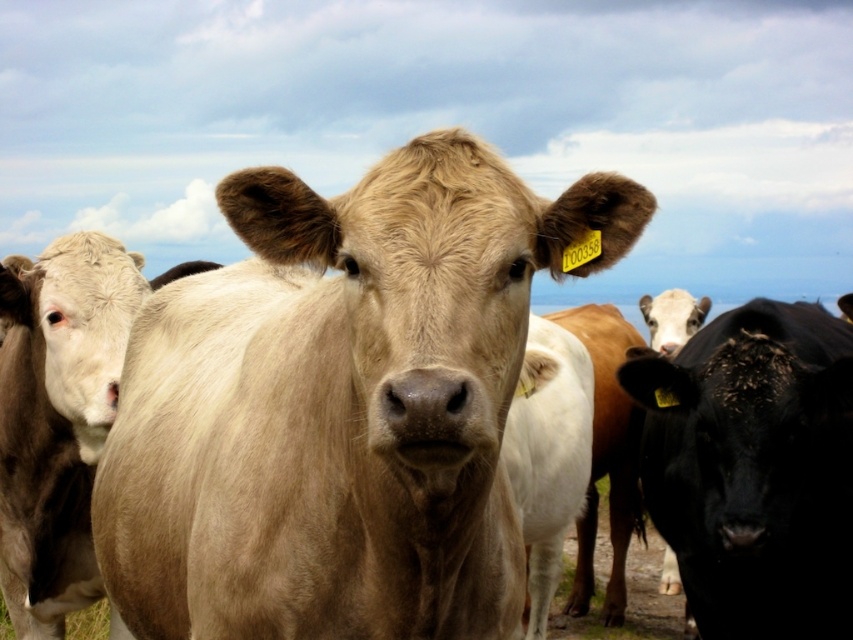
You are a farmer checking on your cattle. You notice the smooth tan cow at center and the black glossy bull at right. Which animal is positioned higher in the image?

The smooth tan cow at center is positioned higher in the image than the black glossy bull at right.

You are standing at the origin point of the image coordinate system. You want to locate the smooth tan cow at center. In which direction should you move relative to your current position to reach it?

The smooth tan cow at center is located at coordinate point 0.634 on the x axis and 0.400 on the y axis. Since you are at the origin point, you should move towards the positive x and positive y direction to reach it.

You are a farmer checking the health of your cattle. You notice the smooth tan cow at center and the black glossy bull at right. Which cow has a smaller body size according to their physical characteristics?

The smooth tan cow at center is thinner than the black glossy bull at right, indicating that the smooth tan cow at center has a smaller body size.